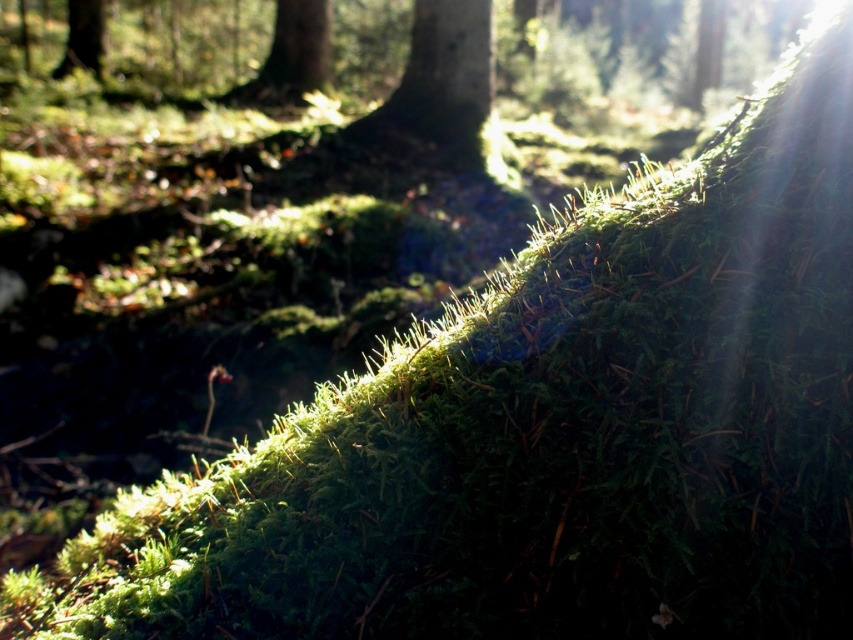
You are standing in the forest and want to take a photo of the green mossy tree trunk at center. If your camera has a focus point at coordinate 0.138, 0.515, will it capture the trunk clearly?

Yes, because the green mossy tree trunk at center is exactly at position (438, 88), so the camera focus point will align perfectly with it.

You are a botanist studying the forest ecosystem. You need to locate the green mossy tree trunk at upper center. What are its coordinates in the image?

The green mossy tree trunk at upper center is located at coordinates point (289, 58).